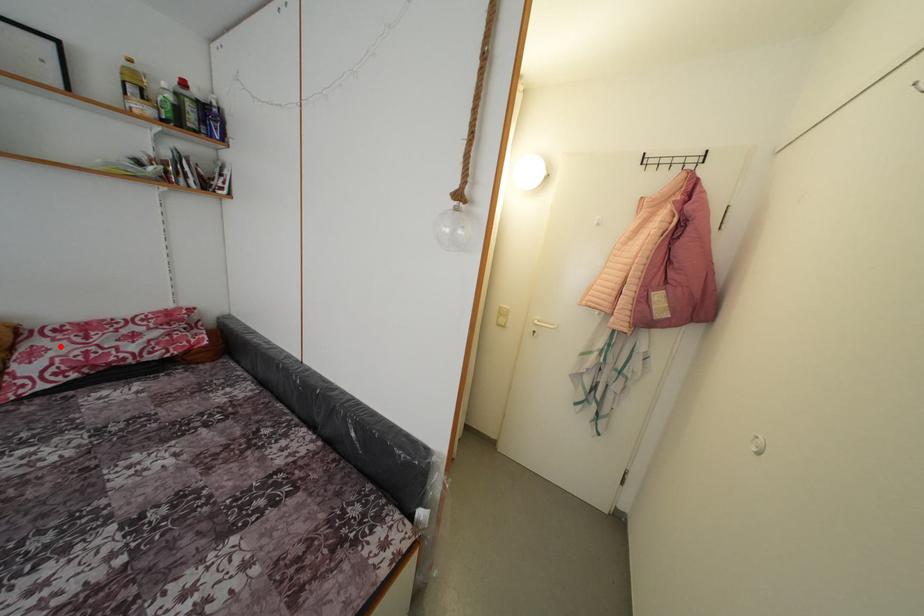
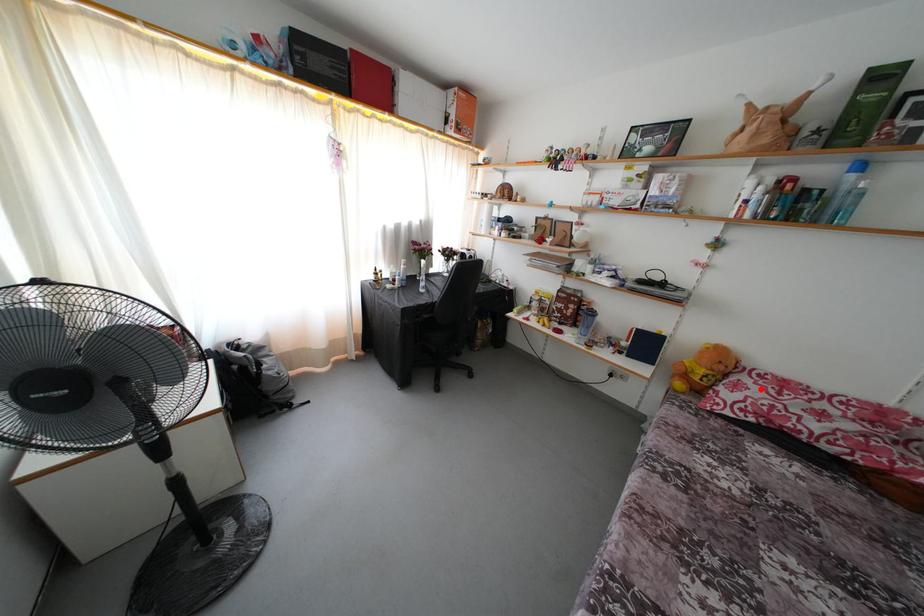
I am providing you with two images of the same scene from different viewpoints. A red point is marked on the first image and another point is marked on the second image. Do the highlighted points in image1 and image2 indicate the same real-world spot?

Yes